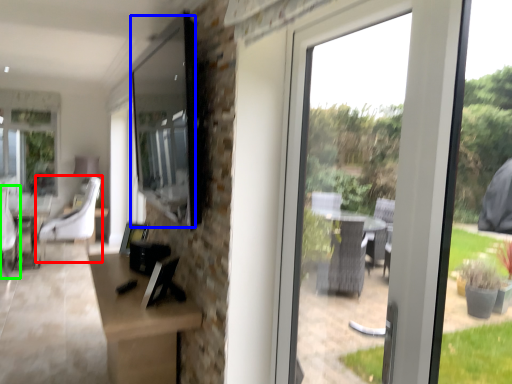
Question: Estimate the real-world distances between objects in this image. Which object is closer to chair (highlighted by a red box), window screen (highlighted by a blue box) or swivel chair (highlighted by a green box)?

Choices:
 (A) window screen
 (B) swivel chair

Answer: (B)